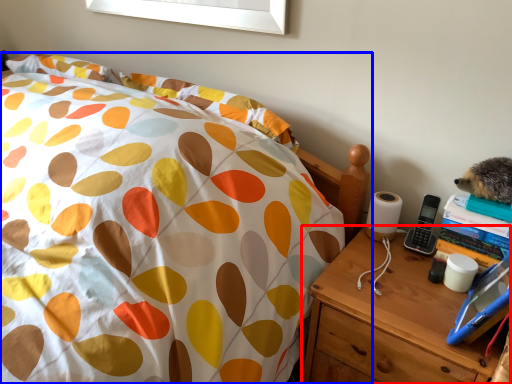
Question: Which object is closer to the camera taking this photo, nightstand (highlighted by a red box) or bed (highlighted by a blue box)?

Choices:
 (A) nightstand
 (B) bed

Answer: (B)